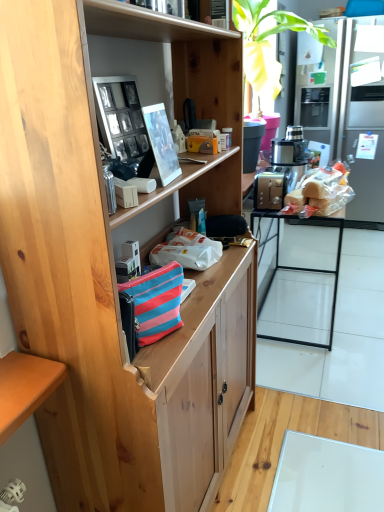
This screenshot has height=512, width=384. What are the coordinates of `vacant area that lies in front of metallic gold toaster at right` in the screenshot? It's located at click(335, 357).